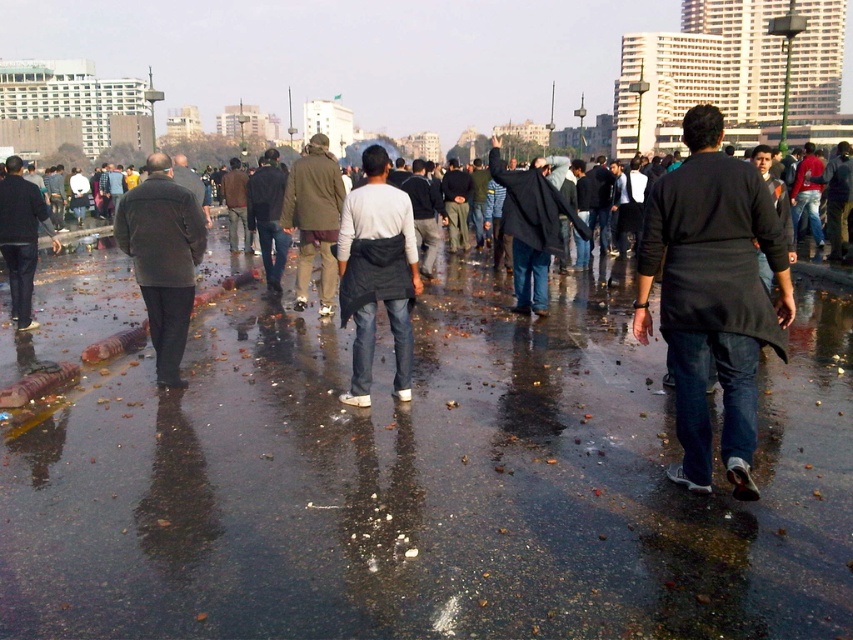
You are standing at the camera position observing the scene. There are two points marked in the image, point A at coordinates point A is point (77, 627) and point B at coordinates point B is point (3, 253). Which point is closer to you?

Point A at coordinates point A is point (77, 627) is closer to you because it is in front of point B at coordinates point B is point (3, 253).